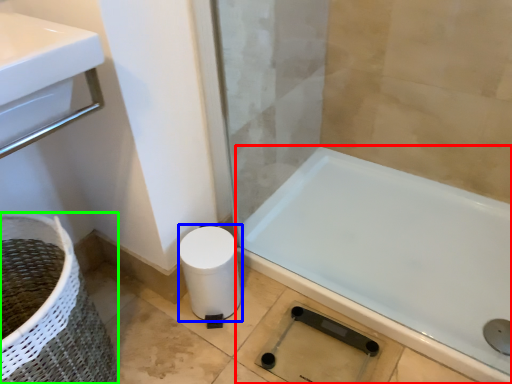
Question: Which is farther away from bathtub (highlighted by a red box)? toilet paper (highlighted by a blue box) or basket container (highlighted by a green box)?

Choices:
 (A) toilet paper
 (B) basket container

Answer: (B)